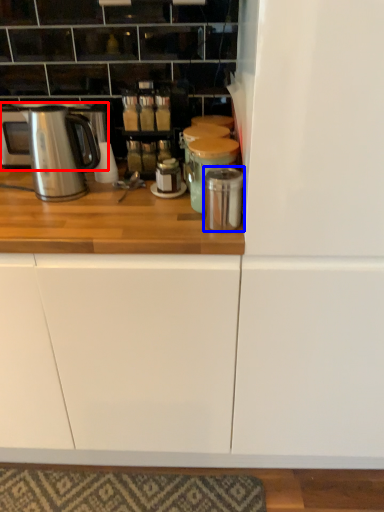
Question: Which object appears closest to the camera in this image, home appliance (highlighted by a red box) or appliance (highlighted by a blue box)?

Choices:
 (A) home appliance
 (B) appliance

Answer: (B)